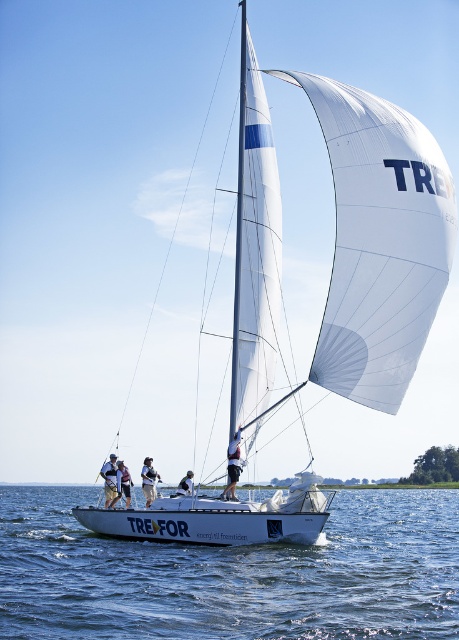
You are a photographer on a nearby boat and want to capture a photo of the TREFOR sailboat. You notice the clear blue water at center and the white fabric sail at center. Which object should you focus on if you want to include both in your frame without cropping either?

You should focus on the clear blue water at center because it might be wider than the white fabric sail at center, allowing both to fit within the frame.

You are standing on the deck of the sailboat and need to reach the point marked at coordinates (331, 564). Given that the boat is 222.48 feet long, can you safely walk to that point without falling overboard?

The point at coordinates (331, 564) is 222.48 feet away from the viewer. Since the boat is 222.48 feet long, reaching that point would require traversing the entire length of the boat, which might be risky without proper safety measures. It is advisable to use handrails or ensure stable footing to avoid falling overboard.